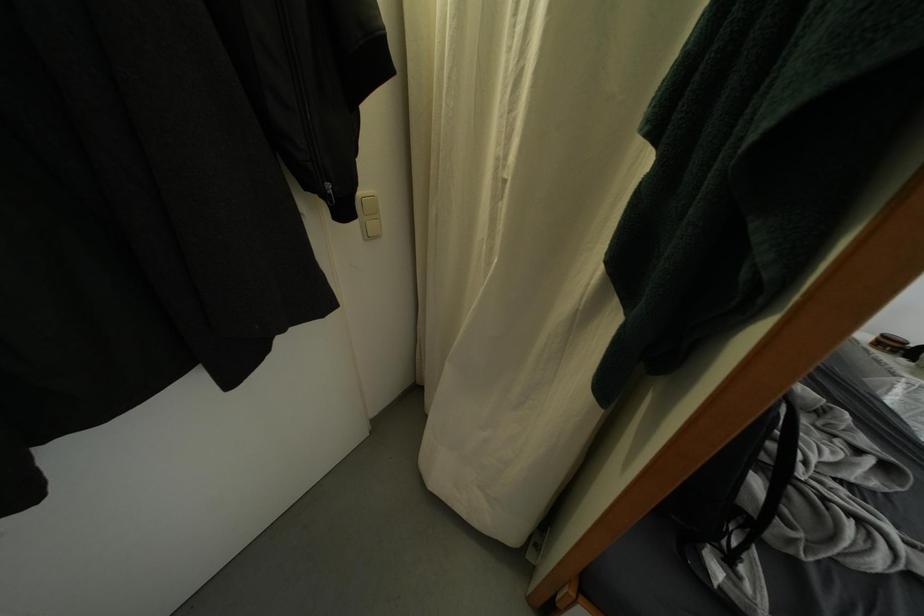
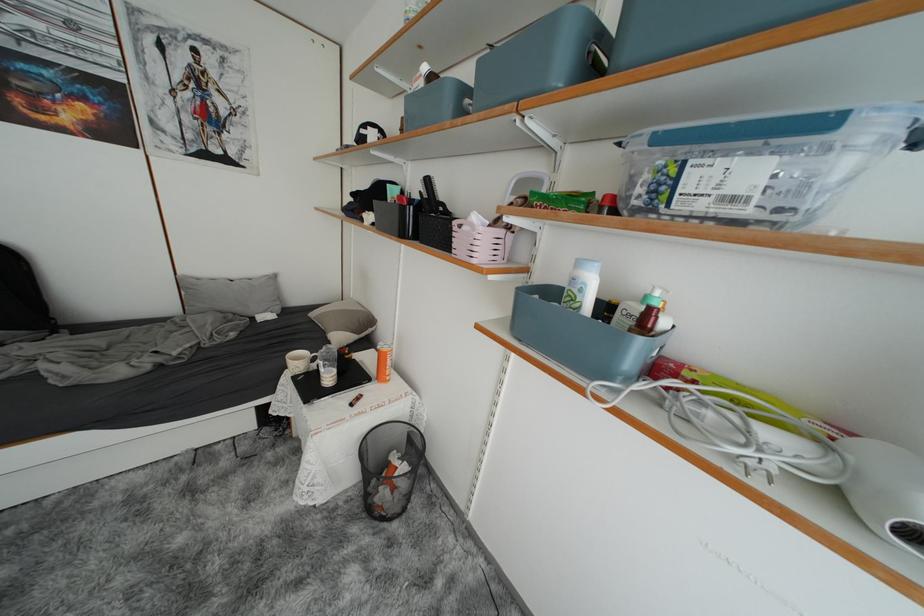
Question: What movement of the cameraman would produce the second image?

Choices:
 (A) Left
 (B) Right
 (C) Forward
 (D) Backward

Answer: (B)